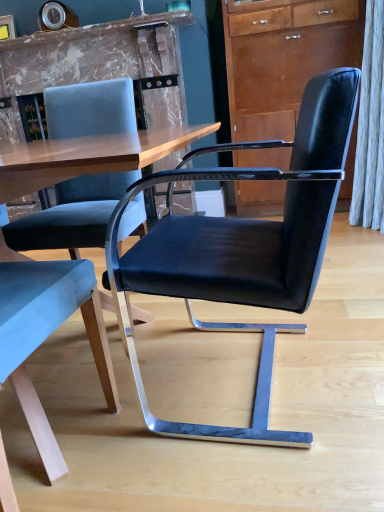
At what (x,y) coordinates should I click in order to perform the action: click on black leather chair at center, placed as the second chair when sorted from left to right. Please return your answer as a coordinate pair (x, y). Looking at the image, I should click on (244, 248).

What is the approximate width of black leather chair at center, marked as the 1th chair in a right-to-left arrangement?

It is 23.85 inches.

You are a GUI agent. You are given a task and a screenshot of the screen. Output one action in this format:
    pyautogui.click(x=<x>, y=<y>)
    Task: Click on the black leather chair at center, marked as the 1th chair in a right-to-left arrangement
    The image size is (384, 512).
    Given the screenshot: What is the action you would take?
    pyautogui.click(x=244, y=248)

Identify the location of chair located behind the velvet blue chair at left, which appears as the 2th chair when viewed from the right. 244,248.

Does point (148, 283) lie behind point (27, 261)?

No, it is in front of (27, 261).

Is black leather chair at center, placed as the second chair when sorted from left to right, outside of velvet blue chair at left, which appears as the 2th chair when viewed from the right?

Yes, black leather chair at center, placed as the second chair when sorted from left to right, is outside of velvet blue chair at left, which appears as the 2th chair when viewed from the right.

Is matte brown cabinet at upper right looking in the opposite direction of black leather chair at center, marked as the 1th chair in a right-to-left arrangement?

No, matte brown cabinet at upper right is not facing away from black leather chair at center, marked as the 1th chair in a right-to-left arrangement.

Which of these two, matte brown cabinet at upper right or black leather chair at center, placed as the second chair when sorted from left to right, stands shorter?

Standing shorter between the two is black leather chair at center, placed as the second chair when sorted from left to right.

Locate an element on the screen. the 1st chair below the matte brown cabinet at upper right (from the image's perspective) is located at coordinates (244, 248).

Can you confirm if matte brown cabinet at upper right is smaller than black leather chair at center, marked as the 1th chair in a right-to-left arrangement?

Incorrect, matte brown cabinet at upper right is not smaller in size than black leather chair at center, marked as the 1th chair in a right-to-left arrangement.

Which point is more distant from viewer, (77, 282) or (343, 18)?

Positioned behind is point (343, 18).

Does velvet blue chair at left, which appears as the 2th chair when viewed from the right, have a larger size compared to matte brown cabinet at upper right?

No.

Is the depth of velvet blue chair at left, which appears as the 2th chair when viewed from the right, less than that of matte brown cabinet at upper right?

Yes, it is.

Is velvet blue chair at left, the first chair from the left, touching matte brown cabinet at upper right?

There is a gap between velvet blue chair at left, the first chair from the left, and matte brown cabinet at upper right.

From a real-world perspective, which is physically above, matte brown cabinet at upper right or velvet blue chair at left, the first chair from the left?

From a 3D spatial view, matte brown cabinet at upper right is above.

Does point (344, 12) lie behind point (54, 305)?

That is True.

Which is behind, matte brown cabinet at upper right or velvet blue chair at left, the first chair from the left?

matte brown cabinet at upper right is further from the camera.

Based on the photo, which is further, (85, 262) or (177, 230)?

The point (177, 230) is behind.

Which of these two, velvet blue chair at left, which appears as the 2th chair when viewed from the right, or black leather chair at center, placed as the second chair when sorted from left to right, is thinner?

velvet blue chair at left, which appears as the 2th chair when viewed from the right, is thinner.

Which object is closer to the camera, velvet blue chair at left, the first chair from the left, or black leather chair at center, marked as the 1th chair in a right-to-left arrangement?

velvet blue chair at left, the first chair from the left.

Is velvet blue chair at left, the first chair from the left, not within black leather chair at center, marked as the 1th chair in a right-to-left arrangement?

That's correct, velvet blue chair at left, the first chair from the left, is outside of black leather chair at center, marked as the 1th chair in a right-to-left arrangement.

Locate an element on the screen. The width and height of the screenshot is (384, 512). chair that is the 1st object to the left of the matte brown cabinet at upper right, starting at the anchor is located at coordinates (244, 248).

From a real-world perspective, is black leather chair at center, marked as the 1th chair in a right-to-left arrangement, on top of matte brown cabinet at upper right?

No, from a real-world perspective, black leather chair at center, marked as the 1th chair in a right-to-left arrangement, is not on top of matte brown cabinet at upper right.

In the image, is black leather chair at center, placed as the second chair when sorted from left to right, on the left side or the right side of matte brown cabinet at upper right?

black leather chair at center, placed as the second chair when sorted from left to right, is positioned on matte brown cabinet at upper right's left side.

Looking at this image, how many degrees apart are the facing directions of black leather chair at center, marked as the 1th chair in a right-to-left arrangement, and matte brown cabinet at upper right?

88.3 degrees.

Find the location of a particular element. The width and height of the screenshot is (384, 512). chair below the velvet blue chair at left, which appears as the 2th chair when viewed from the right (from a real-world perspective) is located at coordinates (244, 248).

The image size is (384, 512). I want to click on the 1st chair to the left of the matte brown cabinet at upper right, starting your count from the anchor, so click(x=244, y=248).

Considering their positions, is velvet blue chair at left, which appears as the 2th chair when viewed from the right, positioned closer to black leather chair at center, marked as the 1th chair in a right-to-left arrangement, than matte brown cabinet at upper right?

velvet blue chair at left, which appears as the 2th chair when viewed from the right.

Which object lies nearer to the anchor point velvet blue chair at left, which appears as the 2th chair when viewed from the right, matte brown cabinet at upper right or black leather chair at center, marked as the 1th chair in a right-to-left arrangement?

The object closer to velvet blue chair at left, which appears as the 2th chair when viewed from the right, is black leather chair at center, marked as the 1th chair in a right-to-left arrangement.

From the image, which object appears to be farther from matte brown cabinet at upper right, black leather chair at center, marked as the 1th chair in a right-to-left arrangement, or velvet blue chair at left, the first chair from the left?

velvet blue chair at left, the first chair from the left.

In the scene shown: Which object lies further to the anchor point matte brown cabinet at upper right, velvet blue chair at left, the first chair from the left, or black leather chair at center, marked as the 1th chair in a right-to-left arrangement?

velvet blue chair at left, the first chair from the left, is positioned further to the anchor matte brown cabinet at upper right.

When comparing their distances from velvet blue chair at left, which appears as the 2th chair when viewed from the right, does black leather chair at center, marked as the 1th chair in a right-to-left arrangement, or matte brown cabinet at upper right seem closer?

black leather chair at center, marked as the 1th chair in a right-to-left arrangement.

Based on their spatial positions, is matte brown cabinet at upper right or velvet blue chair at left, the first chair from the left, further from black leather chair at center, marked as the 1th chair in a right-to-left arrangement?

The object further to black leather chair at center, marked as the 1th chair in a right-to-left arrangement, is matte brown cabinet at upper right.

Where is `chair located between velvet blue chair at left, which appears as the 2th chair when viewed from the right, and matte brown cabinet at upper right in the depth direction`? This screenshot has width=384, height=512. chair located between velvet blue chair at left, which appears as the 2th chair when viewed from the right, and matte brown cabinet at upper right in the depth direction is located at coordinates (244, 248).